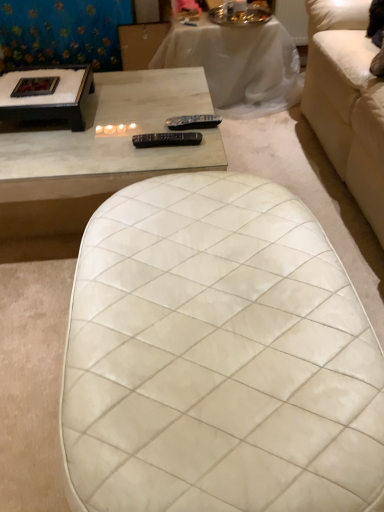
Question: Is blue floral fabric at upper left inside white quilted ottoman at center, the first table ordered from the bottom?

Choices:
 (A) no
 (B) yes

Answer: (A)

Question: Does white quilted ottoman at center, the first table ordered from the bottom, have a smaller size compared to blue floral fabric at upper left?

Choices:
 (A) yes
 (B) no

Answer: (B)

Question: From a real-world perspective, is white quilted ottoman at center, which appears as the 2th table when viewed from the back, positioned under blue floral fabric at upper left based on gravity?

Choices:
 (A) yes
 (B) no

Answer: (A)

Question: Is white quilted ottoman at center, acting as the 2th table starting from the top, shorter than blue floral fabric at upper left?

Choices:
 (A) no
 (B) yes

Answer: (B)

Question: Is white quilted ottoman at center, which appears as the 2th table when viewed from the back, oriented away from blue floral fabric at upper left?

Choices:
 (A) no
 (B) yes

Answer: (A)

Question: In the image, is white marble coffee table at upper left, acting as the first coffee table starting from the right, on the left side or the right side of black wood coffee table at upper left, which ranks as the second coffee table in right-to-left order?

Choices:
 (A) left
 (B) right

Answer: (B)

Question: Considering their positions, is white marble coffee table at upper left, placed as the 2th coffee table when sorted from left to right, located in front of or behind black wood coffee table at upper left, which ranks as the first coffee table in left-to-right order?

Choices:
 (A) behind
 (B) front

Answer: (B)

Question: Considering the positions of point (208, 113) and point (46, 95), is point (208, 113) closer or farther from the camera than point (46, 95)?

Choices:
 (A) closer
 (B) farther

Answer: (B)

Question: Based on their sizes in the image, would you say white marble coffee table at upper left, acting as the first coffee table starting from the right, is bigger or smaller than black wood coffee table at upper left, which ranks as the second coffee table in right-to-left order?

Choices:
 (A) small
 (B) big

Answer: (B)

Question: Considering the positions of black plastic remote at center, which ranks as the first remote in bottom-to-top order, and white marble coffee table at upper left, acting as the first coffee table starting from the right, in the image, is black plastic remote at center, which ranks as the first remote in bottom-to-top order, bigger or smaller than white marble coffee table at upper left, acting as the first coffee table starting from the right,?

Choices:
 (A) small
 (B) big

Answer: (A)

Question: Considering the positions of black plastic remote at center, the 2th remote in the back-to-front sequence, and white marble coffee table at upper left, placed as the 2th coffee table when sorted from left to right, in the image, is black plastic remote at center, the 2th remote in the back-to-front sequence, wider or thinner than white marble coffee table at upper left, placed as the 2th coffee table when sorted from left to right,?

Choices:
 (A) thin
 (B) wide

Answer: (A)

Question: Considering the positions of black plastic remote at center, the 2th remote in the back-to-front sequence, and white marble coffee table at upper left, placed as the 2th coffee table when sorted from left to right, in the image, is black plastic remote at center, the 2th remote in the back-to-front sequence, taller or shorter than white marble coffee table at upper left, placed as the 2th coffee table when sorted from left to right,?

Choices:
 (A) short
 (B) tall

Answer: (A)

Question: Visually, is black plastic remote at center, the 2th remote in the back-to-front sequence, positioned to the left or to the right of white marble coffee table at upper left, placed as the 2th coffee table when sorted from left to right?

Choices:
 (A) left
 (B) right

Answer: (B)

Question: In the image, is white marble coffee table at upper left, acting as the first coffee table starting from the right, positioned in front of or behind white quilted ottoman at center, acting as the 2th table starting from the top?

Choices:
 (A) front
 (B) behind

Answer: (B)

Question: From the image's perspective, is white marble coffee table at upper left, placed as the 2th coffee table when sorted from left to right, positioned above or below white quilted ottoman at center, acting as the 2th table starting from the top?

Choices:
 (A) above
 (B) below

Answer: (A)